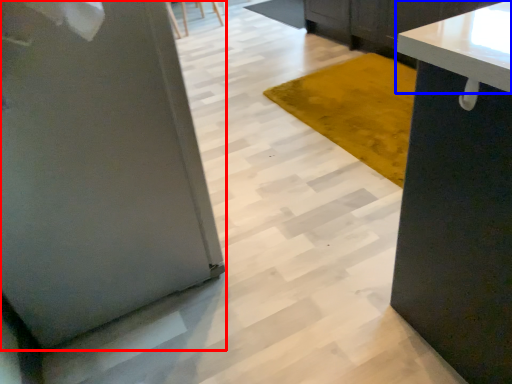
Question: Which point is further to the camera, pillar (highlighted by a red box) or countertop (highlighted by a blue box)?

Choices:
 (A) pillar
 (B) countertop

Answer: (B)